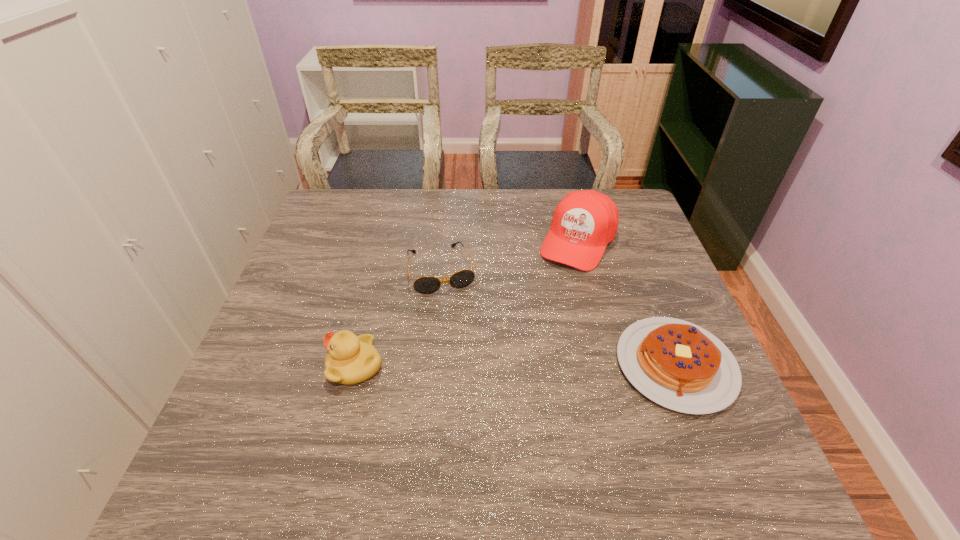
Identify the location of free space located 0.060m on the front panel of the baseball cap. (557, 282).

Image resolution: width=960 pixels, height=540 pixels. I want to click on free point located on the front panel of the baseball cap, so click(x=530, y=327).

Find the location of a particular element. Image resolution: width=960 pixels, height=540 pixels. free spot located on the lenses of the second object from left to right is located at coordinates (466, 354).

Identify the location of vacant region located 0.380m on the lenses of the second object from left to right. The height and width of the screenshot is (540, 960). (486, 424).

Where is `blank space located 0.260m on the lenses of the second object from left to right`? Image resolution: width=960 pixels, height=540 pixels. blank space located 0.260m on the lenses of the second object from left to right is located at coordinates (471, 376).

This screenshot has width=960, height=540. Find the location of `object located in the far edge section of the desktop`. object located in the far edge section of the desktop is located at coordinates (584, 222).

The width and height of the screenshot is (960, 540). Identify the location of object that is positioned at the near edge. (677, 364).

Where is `pancake that is at the right edge`? The height and width of the screenshot is (540, 960). pancake that is at the right edge is located at coordinates (677, 364).

What are the coordinates of `baseball cap at the right edge` in the screenshot? It's located at (584, 222).

Locate an element on the screen. This screenshot has width=960, height=540. object that is at the far right corner is located at coordinates (584, 222).